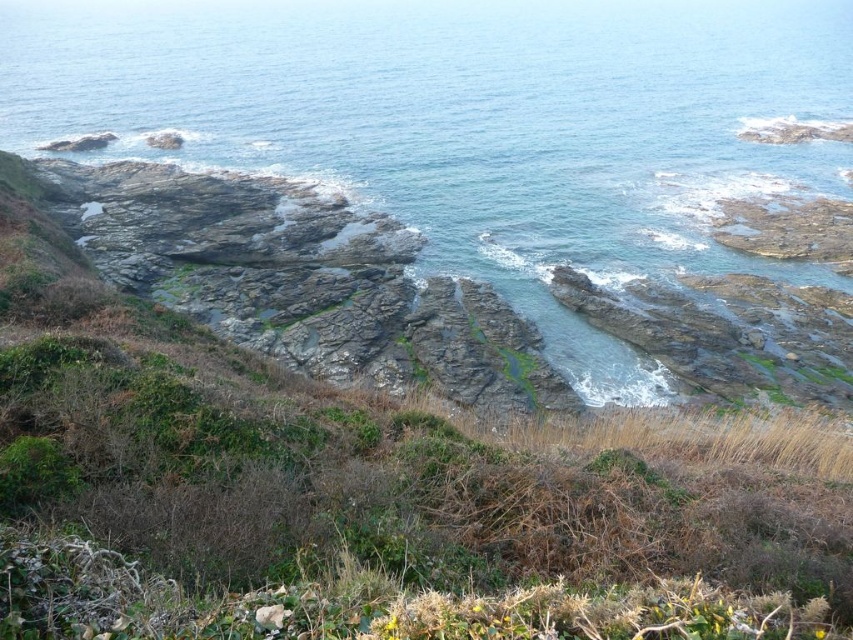
You are a hiker who wants to cross from the rocky area to the beach. You see the clear blue water at center and the rusty stone cliff at center. Which one is higher in elevation?

The clear blue water at center is taller than the rusty stone cliff at center, so the clear blue water at center is higher in elevation.

You are standing on the rugged coastal landscape and want to reach the clear blue water at center. Which direction should you move to get there from your current position at point [471,125]?

The point [471,125] is already on the clear blue water at center, so you are already there.